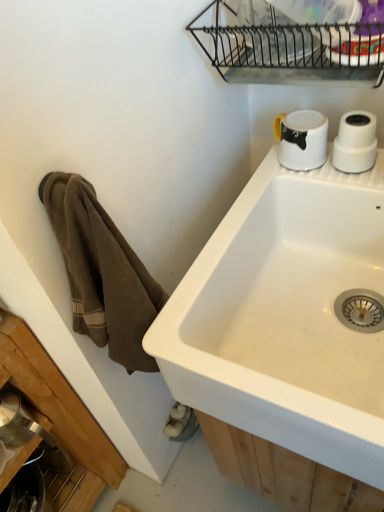
The height and width of the screenshot is (512, 384). What are the coordinates of `vacant area that is in front of white glossy mug at upper right` in the screenshot? It's located at (326, 180).